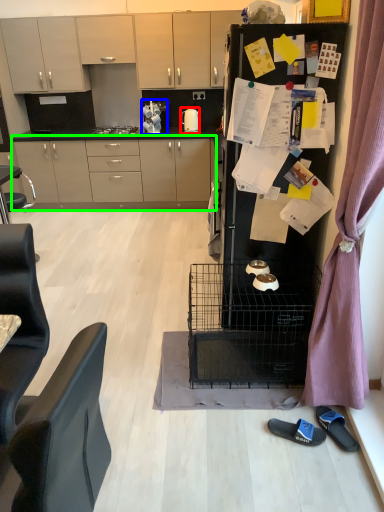
Question: Which object is the closest to the kitchen appliance (highlighted by a red box)? Choose among these: appliance (highlighted by a blue box) or cabinetry (highlighted by a green box).

Choices:
 (A) appliance
 (B) cabinetry

Answer: (A)